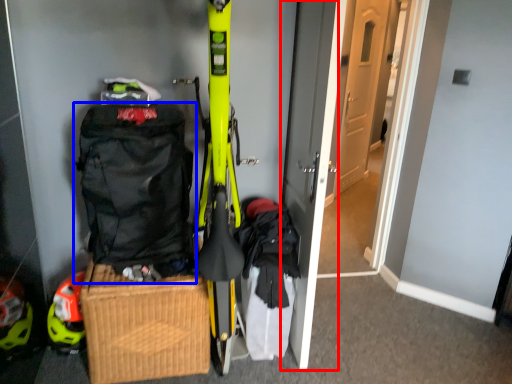
Question: Which point is closer to the camera, door (highlighted by a red box) or backpack (highlighted by a blue box)?

Choices:
 (A) door
 (B) backpack

Answer: (A)